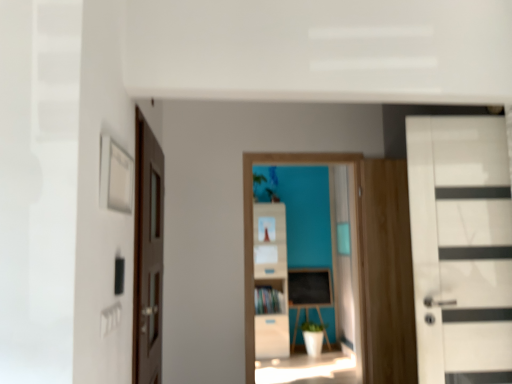
Question: From a real-world perspective, is blackboard at center located higher than white glossy door at right, the second door when ordered from left to right?

Choices:
 (A) no
 (B) yes

Answer: (A)

Question: From the image's perspective, is blackboard at center below white glossy door at right, the second door when ordered from left to right?

Choices:
 (A) no
 (B) yes

Answer: (B)

Question: Is blackboard at center turned away from white glossy door at right, the second door when ordered from left to right?

Choices:
 (A) no
 (B) yes

Answer: (A)

Question: Is blackboard at center not near white glossy door at right, placed as the 1th door when sorted from right to left?

Choices:
 (A) no
 (B) yes

Answer: (B)

Question: Considering the relative positions of blackboard at center and white glossy door at right, the second door when ordered from left to right, in the image provided, is blackboard at center in front of white glossy door at right, the second door when ordered from left to right,?

Choices:
 (A) no
 (B) yes

Answer: (A)

Question: Is white glossy door at right, the second door when ordered from left to right, wider or thinner than wooden file cabinet at center?

Choices:
 (A) thin
 (B) wide

Answer: (A)

Question: Is white glossy door at right, the second door when ordered from left to right, situated inside wooden file cabinet at center or outside?

Choices:
 (A) inside
 (B) outside

Answer: (B)

Question: From the image's perspective, is white glossy door at right, placed as the 1th door when sorted from right to left, located above or below wooden file cabinet at center?

Choices:
 (A) above
 (B) below

Answer: (A)

Question: Is white glossy door at right, the second door when ordered from left to right, taller or shorter than wooden file cabinet at center?

Choices:
 (A) short
 (B) tall

Answer: (A)

Question: Relative to blackboard at center, is wooden file cabinet at center in front or behind?

Choices:
 (A) front
 (B) behind

Answer: (A)

Question: Considering the positions of wooden file cabinet at center and blackboard at center in the image, is wooden file cabinet at center wider or thinner than blackboard at center?

Choices:
 (A) wide
 (B) thin

Answer: (A)

Question: From the image's perspective, is wooden file cabinet at center located above or below blackboard at center?

Choices:
 (A) above
 (B) below

Answer: (A)

Question: In terms of size, does wooden file cabinet at center appear bigger or smaller than blackboard at center?

Choices:
 (A) big
 (B) small

Answer: (A)

Question: From their relative heights in the image, would you say wooden cabinet at center is taller or shorter than brown wooden door at left, placed as the first door when sorted from left to right?

Choices:
 (A) tall
 (B) short

Answer: (B)

Question: Looking at the image, does wooden cabinet at center seem bigger or smaller compared to brown wooden door at left, the second door viewed from the right?

Choices:
 (A) big
 (B) small

Answer: (B)